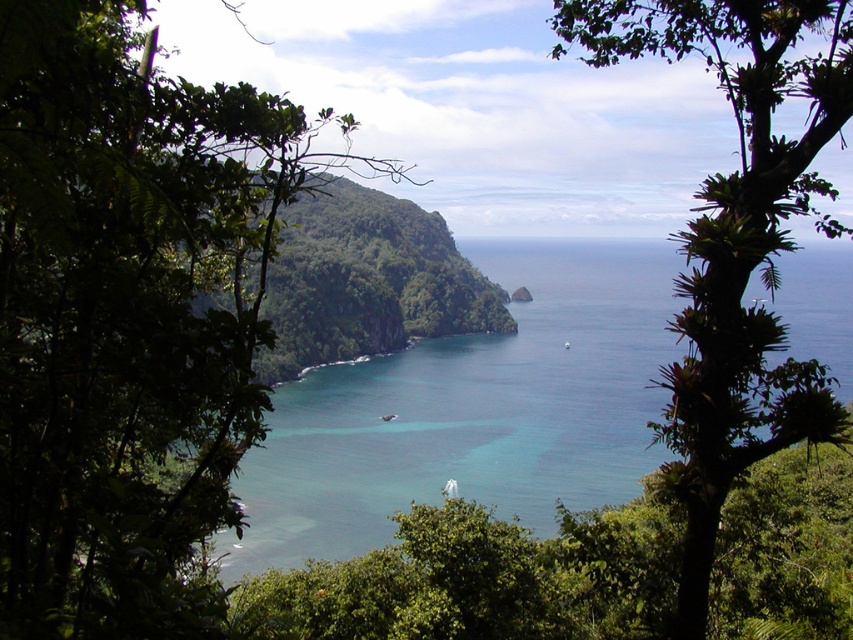
You are standing in the forest and want to walk through the gap between the green leafy tree at center and the green leafy tree at right. Which tree has a narrower gap on its side?

The green leafy tree at center has a lesser width compared to green leafy tree at right, so the gap on the side of the green leafy tree at center is narrower.

You are standing in the forest and want to reach the clear blue water at center. There is a green leafy tree at right blocking your path. Can you walk straight ahead without going around the tree?

The clear blue water at center is further to the viewer than the green leafy tree at right, meaning the tree is closer to you. Therefore, walking straight ahead would require moving past the tree, so you cannot go straight without going around it.

You are standing in a forest and see the green leafy tree at center and the clear blue water at center. Which object is nearer to you?

The green leafy tree at center is closer to the viewer than the clear blue water at center.